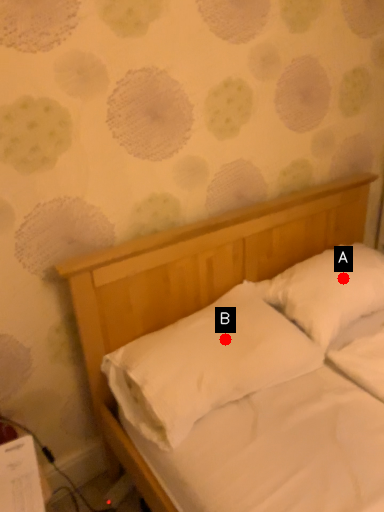
Question: Two points are circled on the image, labeled by A and B beside each circle. Which point is closer to the camera taking this photo?

Choices:
 (A) A is closer
 (B) B is closer

Answer: (B)